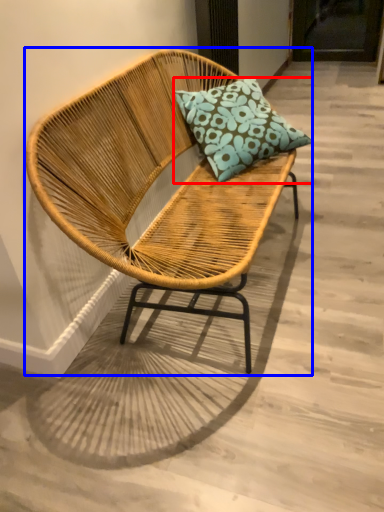
Question: Which object appears closest to the camera in this image, pillow (highlighted by a red box) or chair (highlighted by a blue box)?

Choices:
 (A) pillow
 (B) chair

Answer: (B)